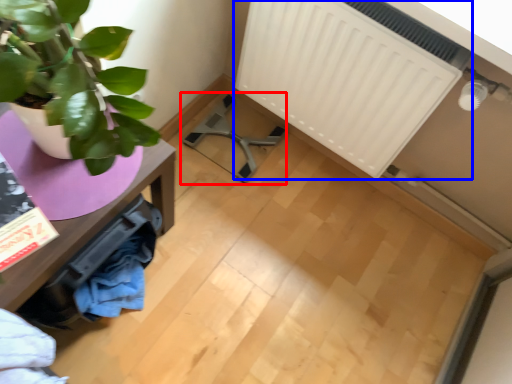
Question: Among these objects, which one is nearest to the camera, swivel chair (highlighted by a red box) or radiator (highlighted by a blue box)?

Choices:
 (A) swivel chair
 (B) radiator

Answer: (B)